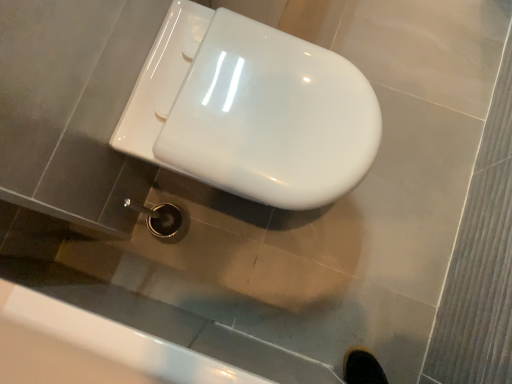
The image size is (512, 384). Identify the location of empty space that is to the right of white glossy toilet at center. (396, 196).